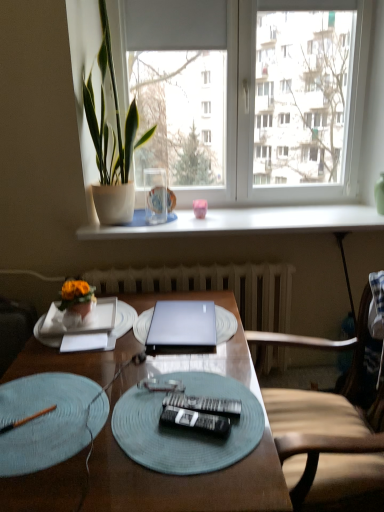
In order to click on empty space that is ontop of white paper at left (from a real-world perspective) in this screenshot , I will do `click(102, 318)`.